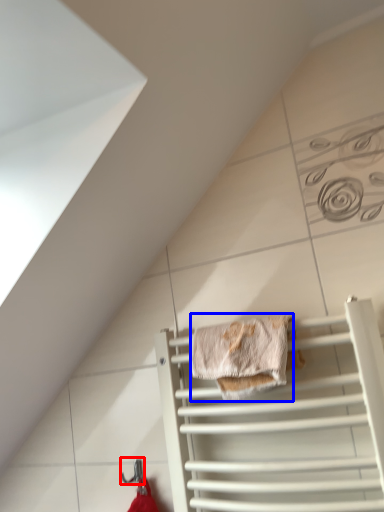
Question: Which object is closer to the camera taking this photo, hanger (highlighted by a red box) or material (highlighted by a blue box)?

Choices:
 (A) hanger
 (B) material

Answer: (B)